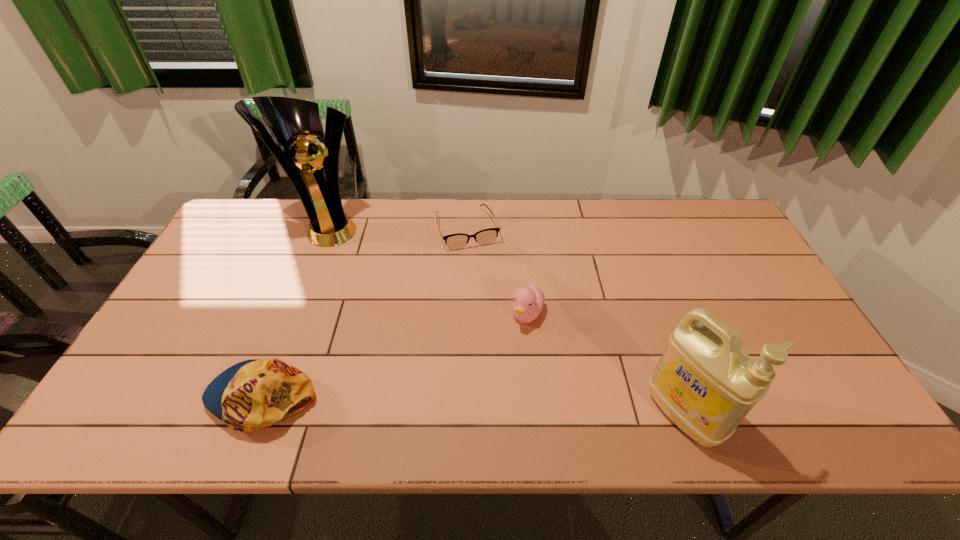
Locate an element on the screen. The height and width of the screenshot is (540, 960). free region located 0.350m on the face of the spectacles is located at coordinates (506, 339).

Identify the location of award positioned at the far edge. This screenshot has width=960, height=540. (294, 123).

Find the location of a particular element. This screenshot has width=960, height=540. spectacles situated at the far edge is located at coordinates (457, 241).

Locate an element on the screen. This screenshot has height=540, width=960. cap present at the near edge is located at coordinates (254, 394).

Where is `detergent located at the near edge`? This screenshot has height=540, width=960. detergent located at the near edge is located at coordinates (705, 382).

The image size is (960, 540). Find the location of `free space at the far edge of the desktop`. free space at the far edge of the desktop is located at coordinates (610, 239).

In the image, there is a desktop. Identify the location of vacant area at the near edge. The width and height of the screenshot is (960, 540). (504, 380).

Locate an element on the screen. vacant space at the left edge of the desktop is located at coordinates (204, 287).

In the image, there is a desktop. Identify the location of free space at the right edge. (756, 343).

Find the location of `free space at the far left corner of the desktop`. free space at the far left corner of the desktop is located at coordinates pos(261,209).